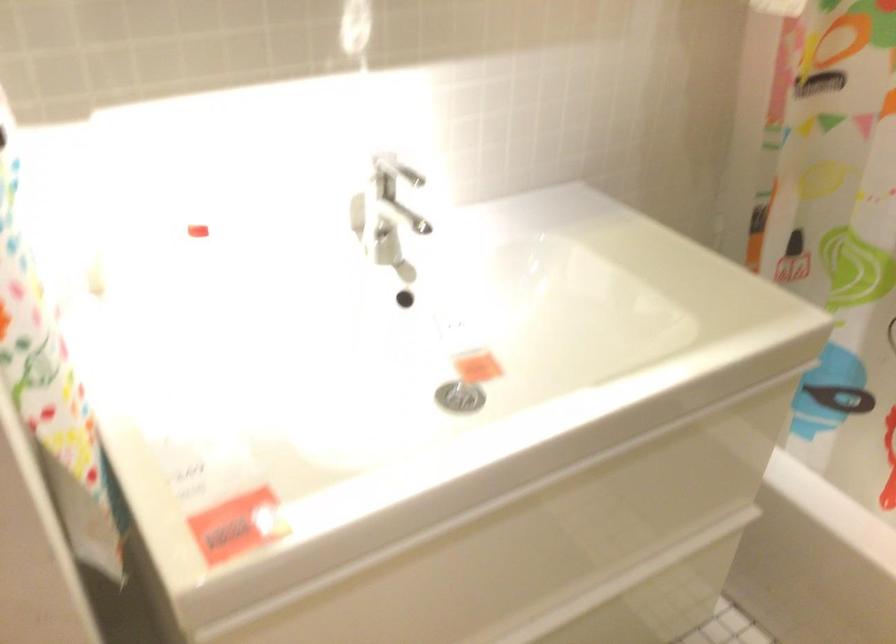
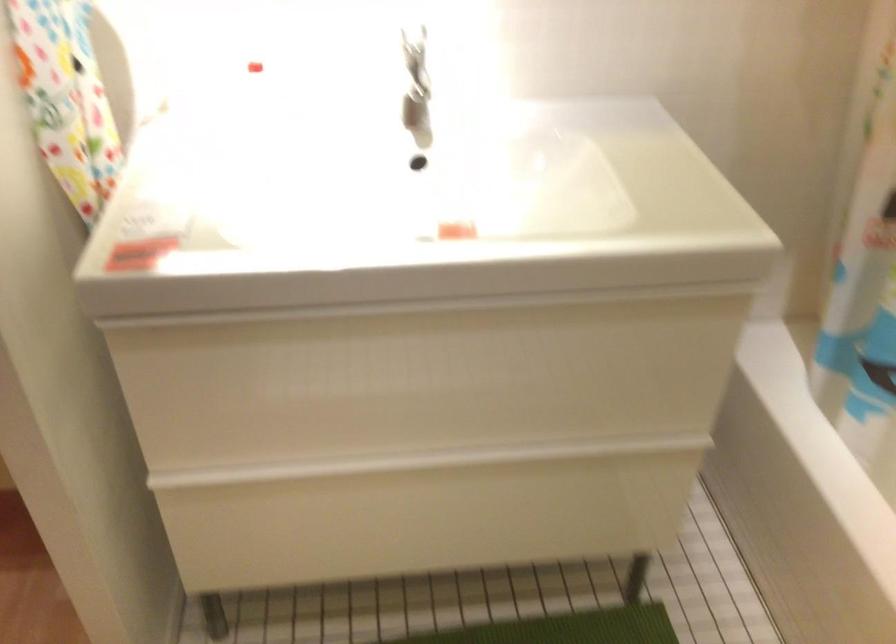
Question: The first image is from the beginning of the video and the second image is from the end. How did the camera likely rotate when shooting the video?

Choices:
 (A) Left
 (B) Right
 (C) Up
 (D) Down

Answer: (A)